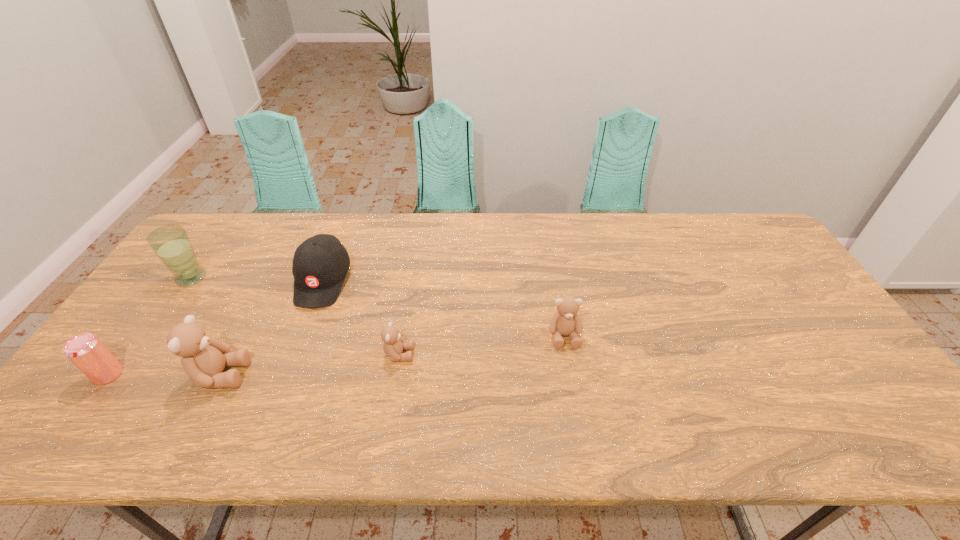
The width and height of the screenshot is (960, 540). I want to click on free space located 0.140m on the front-facing side of the shortest teddy bear, so click(468, 354).

I want to click on vacant area located on the front-facing side of the second shortest teddy bear, so click(570, 373).

Identify the location of free space located 0.340m on the front of the glass. (114, 388).

This screenshot has width=960, height=540. In order to click on vacant space located with a logo on the front of the third object from right to left in this screenshot , I will do `click(304, 330)`.

Identify the location of free region located on the right of the beer can. (210, 374).

Where is `object situated at the far edge`? The image size is (960, 540). object situated at the far edge is located at coordinates (320, 264).

At what (x,y) coordinates should I click in order to perform the action: click on teddy bear that is positioned at the near edge. Please return your answer as a coordinate pair (x, y). Looking at the image, I should click on (203, 359).

Where is `beer can that is at the near edge`? beer can that is at the near edge is located at coordinates click(x=85, y=350).

Where is `glass that is positioned at the left edge`? The height and width of the screenshot is (540, 960). glass that is positioned at the left edge is located at coordinates (171, 243).

The height and width of the screenshot is (540, 960). Identify the location of beer can located in the left edge section of the desktop. (85, 350).